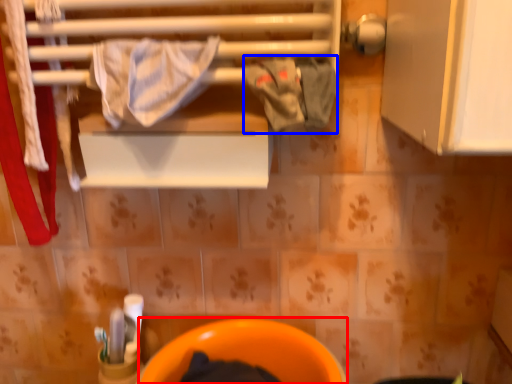
Question: Which object appears farthest to the camera in this image, toilet bowl (highlighted by a red box) or clothing (highlighted by a blue box)?

Choices:
 (A) toilet bowl
 (B) clothing

Answer: (A)